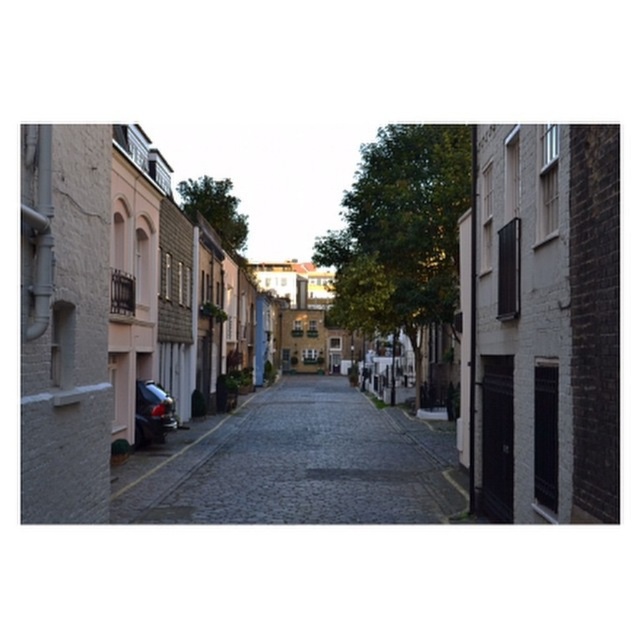
You are a delivery person trying to navigate through the narrow street. You see the dark gray cobblestone alley at center and the shiny metallic car at lower left. Which direction should you move to avoid the car?

The dark gray cobblestone alley at center is positioned on the right side of the shiny metallic car at lower left, so you should move to the right to avoid the car.

You are a delivery person trying to navigate through the dark gray cobblestone alley at center. There is a shiny metallic car at lower left parked nearby. Can you estimate whether the alley is wide enough to allow a standard delivery van to pass through?

The dark gray cobblestone alley at center is larger in size than the shiny metallic car at lower left. Since the alley is wider than the car, it should be wide enough for a standard delivery van to pass through, as the car itself can fit within the alley.

You are standing on the street and want to take a photo of the dark gray cobblestone alley at center and the shiny metallic car at lower left. Which object should you focus on first to ensure both are in the frame?

You should focus on the dark gray cobblestone alley at center first because it is closer to the viewer than the shiny metallic car at lower left, so adjusting the focus to it will help keep both in the frame.